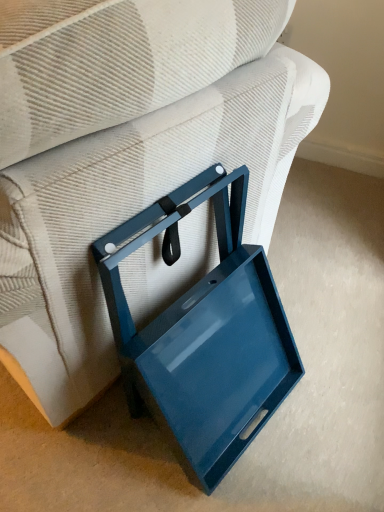
Question: Is glossy blue tray at lower right shorter than glossy blue tray at lower center?

Choices:
 (A) yes
 (B) no

Answer: (B)

Question: From a real-world perspective, is glossy blue tray at lower right located beneath glossy blue tray at lower center?

Choices:
 (A) no
 (B) yes

Answer: (A)

Question: Is glossy blue tray at lower right to the right of glossy blue tray at lower center from the viewer's perspective?

Choices:
 (A) no
 (B) yes

Answer: (A)

Question: Is glossy blue tray at lower center surrounded by glossy blue tray at lower right?

Choices:
 (A) no
 (B) yes

Answer: (A)

Question: From a real-world perspective, is glossy blue tray at lower right over glossy blue tray at lower center?

Choices:
 (A) yes
 (B) no

Answer: (A)

Question: Does glossy blue tray at lower right have a greater width compared to glossy blue tray at lower center?

Choices:
 (A) yes
 (B) no

Answer: (A)

Question: Is glossy blue tray at lower center placed right next to glossy blue tray at lower right?

Choices:
 (A) no
 (B) yes

Answer: (A)

Question: From the image's perspective, is glossy blue tray at lower center under glossy blue tray at lower right?

Choices:
 (A) no
 (B) yes

Answer: (B)

Question: Is glossy blue tray at lower center shorter than glossy blue tray at lower right?

Choices:
 (A) yes
 (B) no

Answer: (A)

Question: Is glossy blue tray at lower center closer to the viewer compared to glossy blue tray at lower right?

Choices:
 (A) yes
 (B) no

Answer: (B)

Question: Is glossy blue tray at lower center outside of glossy blue tray at lower right?

Choices:
 (A) yes
 (B) no

Answer: (A)

Question: Could you tell me if glossy blue tray at lower center is turned towards glossy blue tray at lower right?

Choices:
 (A) no
 (B) yes

Answer: (A)

Question: From a real-world perspective, is glossy blue tray at lower right above or below glossy blue tray at lower center?

Choices:
 (A) above
 (B) below

Answer: (A)